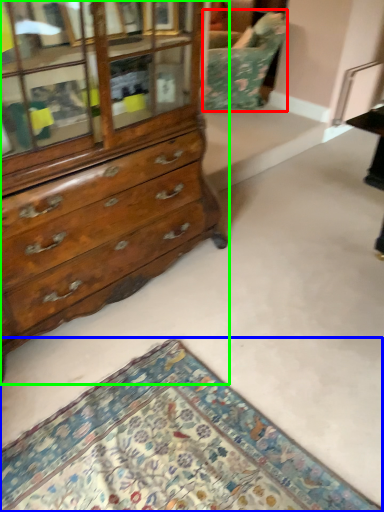
Question: Based on their relative distances, which object is farther from swivel chair (highlighted by a red box)? Choose from mat (highlighted by a blue box) and chest of drawers (highlighted by a green box).

Choices:
 (A) mat
 (B) chest of drawers

Answer: (A)